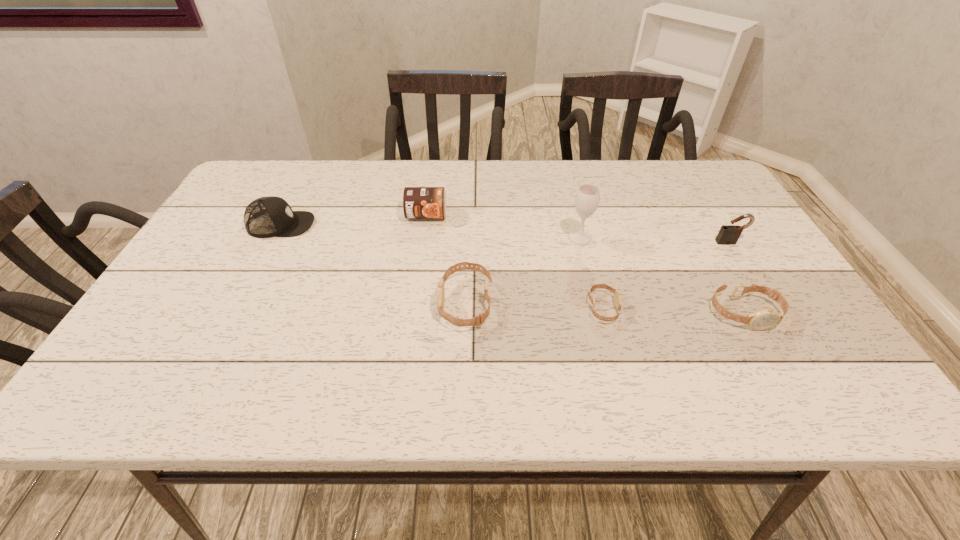
You are a GUI agent. You are given a task and a screenshot of the screen. Output one action in this format:
    pyautogui.click(x=<x>, y=<y>)
    Task: Click on the vacant space located on the face of the third object from left to right
    
    Given the screenshot: What is the action you would take?
    pyautogui.click(x=276, y=303)

Identify the location of blank space located on the face of the third object from left to right. (391, 303).

Locate an element on the screen. This screenshot has width=960, height=540. blank space located on the face of the second watch from right to left is located at coordinates (694, 308).

At what (x,y) coordinates should I click in order to perform the action: click on free space located with the keyhole on the front of the padlock. Please return your answer as a coordinate pair (x, y). The width and height of the screenshot is (960, 540). Looking at the image, I should click on (751, 278).

Find the location of a particular element. This screenshot has height=540, width=960. free spot located 0.320m on the front-facing side of the cap is located at coordinates (431, 225).

What are the coordinates of `vacant area situated 0.380m on the right of the wineglass` in the screenshot? It's located at (734, 239).

This screenshot has width=960, height=540. What are the coordinates of `free point located 0.050m on the front label of the can` in the screenshot? It's located at (423, 237).

Find the location of `object positioned at the left edge`. object positioned at the left edge is located at coordinates (265, 217).

The image size is (960, 540). I want to click on watch located in the right edge section of the desktop, so click(x=764, y=319).

At what (x,y) coordinates should I click in order to perform the action: click on padlock at the right edge. Please return your answer as a coordinate pair (x, y). Looking at the image, I should click on (729, 234).